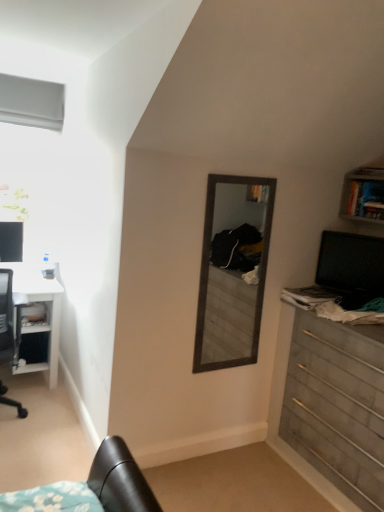
The width and height of the screenshot is (384, 512). I want to click on vacant region under white matte window at upper left (from a real-world perspective), so click(x=36, y=254).